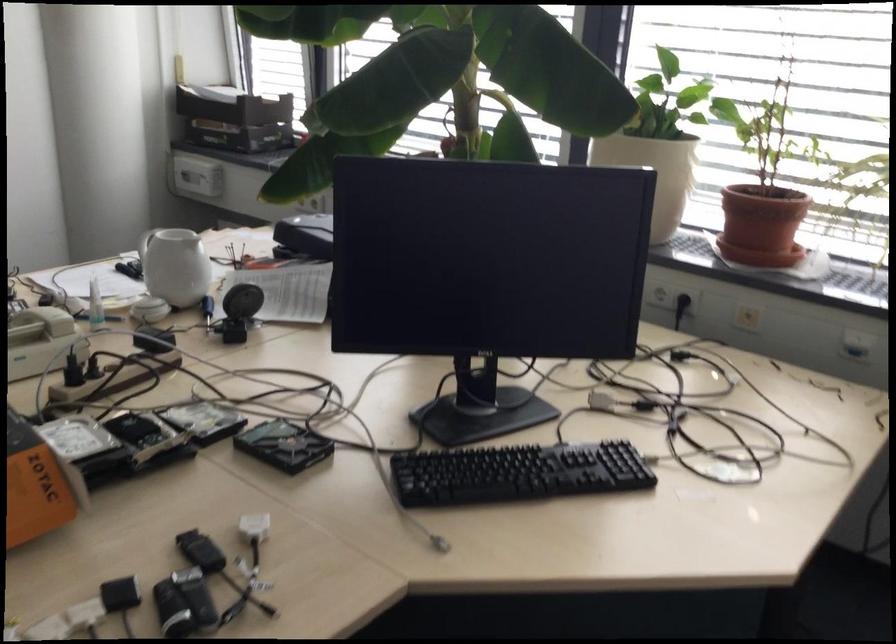
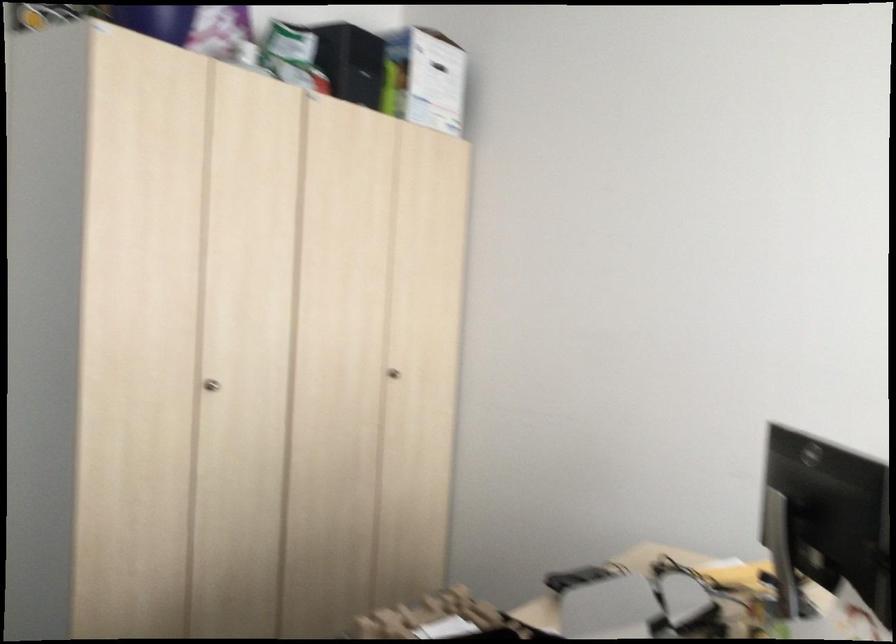
Question: The images are taken continuously from a first-person perspective. In which direction is your viewpoint rotating?

Choices:
 (A) Left
 (B) Right
 (C) Up
 (D) Down

Answer: (A)